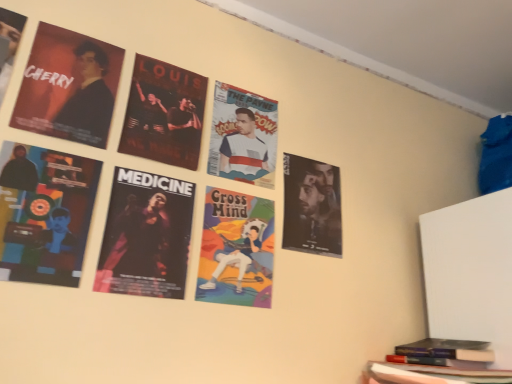
Question: From a real-world perspective, is matte black poster at upper left, the 1th poster in the left-to-right sequence, located beneath dark matte poster at center-left, which ranks as the fourth poster in left-to-right order?

Choices:
 (A) yes
 (B) no

Answer: (B)

Question: Considering the relative positions of matte black poster at upper left, the sixth poster when ordered from right to left, and dark matte poster at center-left, which ranks as the fourth poster in left-to-right order, in the image provided, is matte black poster at upper left, the sixth poster when ordered from right to left, to the left of dark matte poster at center-left, which ranks as the fourth poster in left-to-right order, from the viewer's perspective?

Choices:
 (A) yes
 (B) no

Answer: (A)

Question: Does matte black poster at upper left, the 1th poster in the left-to-right sequence, have a smaller size compared to dark matte poster at center-left, which ranks as the fourth poster in left-to-right order?

Choices:
 (A) yes
 (B) no

Answer: (B)

Question: Is matte black poster at upper left, the 1th poster in the left-to-right sequence, placed right next to dark matte poster at center-left, marked as the third poster in a right-to-left arrangement?

Choices:
 (A) no
 (B) yes

Answer: (A)

Question: Does matte black poster at upper left, the 1th poster in the left-to-right sequence, turn towards dark matte poster at center-left, which ranks as the fourth poster in left-to-right order?

Choices:
 (A) yes
 (B) no

Answer: (B)

Question: Is there a large distance between matte black poster at upper left, the 1th poster in the left-to-right sequence, and dark matte poster at center-left, which ranks as the fourth poster in left-to-right order?

Choices:
 (A) yes
 (B) no

Answer: (B)

Question: From a real-world perspective, is matte black poster at upper left, the third poster when ordered from left to right, under cartoonish paper poster at center?

Choices:
 (A) yes
 (B) no

Answer: (B)

Question: From a real-world perspective, is matte black poster at upper left, the third poster when ordered from left to right, positioned over cartoonish paper poster at center based on gravity?

Choices:
 (A) yes
 (B) no

Answer: (A)

Question: Is matte black poster at upper left, which ranks as the 4th poster in right-to-left order, to the right of cartoonish paper poster at center from the viewer's perspective?

Choices:
 (A) yes
 (B) no

Answer: (B)

Question: From the image's perspective, is matte black poster at upper left, which ranks as the 4th poster in right-to-left order, above cartoonish paper poster at center?

Choices:
 (A) yes
 (B) no

Answer: (A)

Question: Does matte black poster at upper left, which ranks as the 4th poster in right-to-left order, have a smaller size compared to cartoonish paper poster at center?

Choices:
 (A) yes
 (B) no

Answer: (B)

Question: Can you confirm if matte black poster at upper left, which ranks as the 4th poster in right-to-left order, is taller than cartoonish paper poster at center?

Choices:
 (A) yes
 (B) no

Answer: (B)

Question: From the image's perspective, is matte black poster at lower left, the second poster from the left, located above matte black poster at upper left, the sixth poster when ordered from right to left?

Choices:
 (A) yes
 (B) no

Answer: (B)